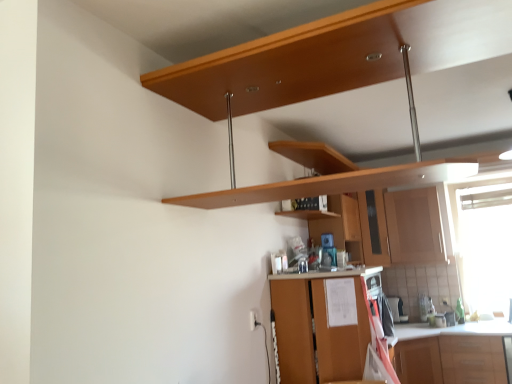
Question: Which direction should I rotate to look at brown wood cabinet at lower center, the third cabinetry positioned from the back, — up or down?

Choices:
 (A) up
 (B) down

Answer: (B)

Question: Is transparent plastic window screen at right outside of matte wood cabinet at center-right, which ranks as the second cabinetry in front-to-back order?

Choices:
 (A) no
 (B) yes

Answer: (B)

Question: Considering the relative positions of transparent plastic window screen at right and matte wood cabinet at center-right, which ranks as the second cabinetry in front-to-back order, in the image provided, is transparent plastic window screen at right to the left of matte wood cabinet at center-right, which ranks as the second cabinetry in front-to-back order, from the viewer's perspective?

Choices:
 (A) yes
 (B) no

Answer: (B)

Question: From a real-world perspective, does transparent plastic window screen at right sit lower than matte wood cabinet at center-right, acting as the 2th cabinetry starting from the back?

Choices:
 (A) yes
 (B) no

Answer: (A)

Question: Considering the relative sizes of transparent plastic window screen at right and matte wood cabinet at center-right, acting as the 2th cabinetry starting from the back, in the image provided, is transparent plastic window screen at right bigger than matte wood cabinet at center-right, acting as the 2th cabinetry starting from the back,?

Choices:
 (A) no
 (B) yes

Answer: (B)

Question: Considering the relative sizes of transparent plastic window screen at right and matte wood cabinet at center-right, which ranks as the second cabinetry in front-to-back order, in the image provided, is transparent plastic window screen at right wider than matte wood cabinet at center-right, which ranks as the second cabinetry in front-to-back order,?

Choices:
 (A) yes
 (B) no

Answer: (B)

Question: From the image's perspective, is transparent plastic window screen at right over matte wood cabinet at center-right, which ranks as the second cabinetry in front-to-back order?

Choices:
 (A) yes
 (B) no

Answer: (B)

Question: Can you confirm if wooden cabinet at center, which is counted as the third cabinetry, starting from the front, is smaller than transparent plastic window screen at right?

Choices:
 (A) no
 (B) yes

Answer: (A)

Question: Is wooden cabinet at center, which is counted as the third cabinetry, starting from the front, at the left side of transparent plastic window screen at right?

Choices:
 (A) yes
 (B) no

Answer: (A)

Question: Is wooden cabinet at center, which is counted as the first cabinetry, starting from the back, at the right side of transparent plastic window screen at right?

Choices:
 (A) yes
 (B) no

Answer: (B)

Question: From a real-world perspective, is wooden cabinet at center, which is counted as the third cabinetry, starting from the front, positioned under transparent plastic window screen at right based on gravity?

Choices:
 (A) yes
 (B) no

Answer: (B)

Question: Is wooden cabinet at center, which is counted as the first cabinetry, starting from the back, surrounding transparent plastic window screen at right?

Choices:
 (A) yes
 (B) no

Answer: (B)

Question: Is wooden cabinet at center, which is counted as the third cabinetry, starting from the front, further to the viewer compared to transparent plastic window screen at right?

Choices:
 (A) yes
 (B) no

Answer: (A)

Question: Does wooden shelf at center lie in front of wooden cabinet at center, which is counted as the first cabinetry, starting from the back?

Choices:
 (A) no
 (B) yes

Answer: (B)